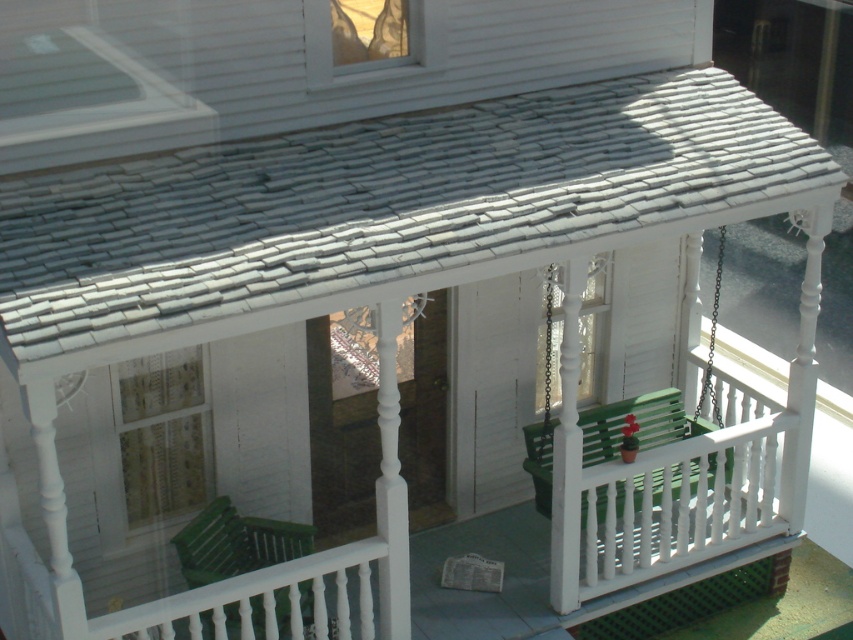
Which is behind, point (567, 470) or point (192, 540)?

Point (192, 540)

Is point (577, 573) positioned behind point (260, 637)?

Yes, it is.

You are a GUI agent. You are given a task and a screenshot of the screen. Output one action in this format:
    pyautogui.click(x=<x>, y=<y>)
    Task: Click on the white wooden balustrade at center
    This screenshot has height=640, width=853.
    Given the screenshot: What is the action you would take?
    pyautogui.click(x=672, y=497)

Is point (602, 557) positioned in front of point (619, 429)?

Yes, it is in front of point (619, 429).

Is point (595, 499) farther from camera compared to point (659, 480)?

No, (595, 499) is closer to viewer.

Which is behind, point (563, 346) or point (590, 426)?

Positioned behind is point (590, 426).

Image resolution: width=853 pixels, height=640 pixels. I want to click on white wooden balustrade at center, so click(x=672, y=497).

Between green wooden bench at center and green plastic rocking chair at lower left, which one is positioned higher?

green wooden bench at center is above.

Does green wooden bench at center appear on the right side of green plastic rocking chair at lower left?

Indeed, green wooden bench at center is positioned on the right side of green plastic rocking chair at lower left.

Where is `green wooden bench at center`? Image resolution: width=853 pixels, height=640 pixels. green wooden bench at center is located at coordinates (650, 410).

This screenshot has width=853, height=640. What are the coordinates of `green wooden bench at center` in the screenshot? It's located at (650, 410).